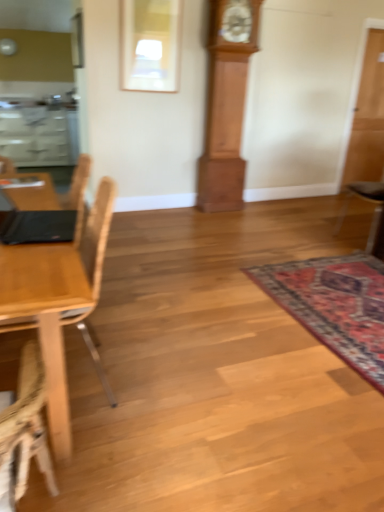
Where is `vacant space to the left of black leather chair at right, which ranks as the first chair in back-to-front order`? vacant space to the left of black leather chair at right, which ranks as the first chair in back-to-front order is located at coordinates (315, 234).